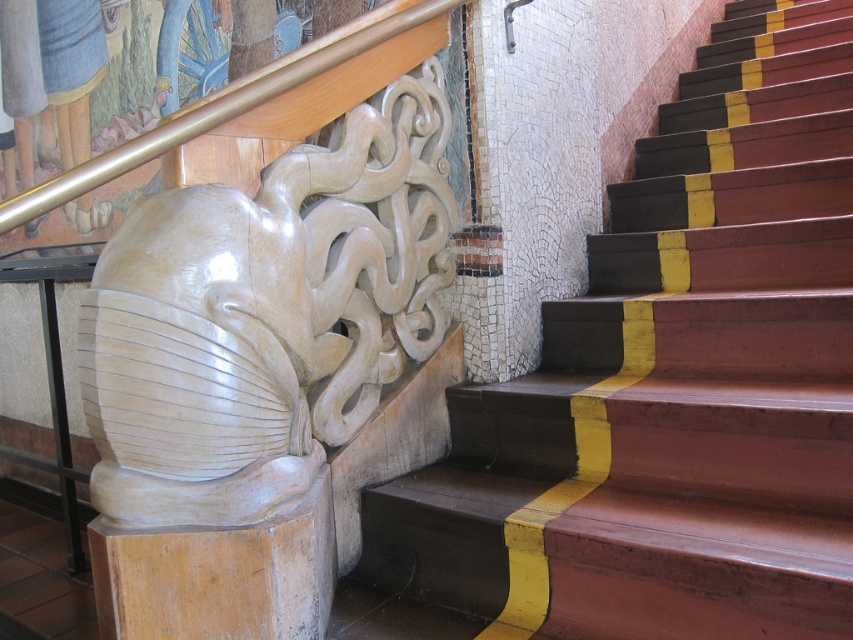
Which is below, matte white sculpture at center or gold polished metal handrail at upper left?

matte white sculpture at center

Does matte white sculpture at center have a lesser width compared to gold polished metal handrail at upper left?

Yes.

Who is more forward, (421, 227) or (102, 164)?

Point (102, 164)

Locate an element on the screen. This screenshot has width=853, height=640. matte white sculpture at center is located at coordinates (265, 316).

Can you confirm if wooden stairs at center is positioned above gold polished metal handrail at upper left?

No, wooden stairs at center is not above gold polished metal handrail at upper left.

Does point (498, 445) come farther from viewer compared to point (286, 65)?

Yes.

Who is more forward, [756,355] or [346,52]?

Positioned in front is point [346,52].

Image resolution: width=853 pixels, height=640 pixels. Find the location of `wooden stairs at center`. wooden stairs at center is located at coordinates (665, 390).

Which is behind, point (807, 580) or point (163, 368)?

The point (163, 368) is behind.

Who is more distant from viewer, (773, 545) or (215, 497)?

Point (215, 497)

Locate an element on the screen. This screenshot has height=640, width=853. wooden stairs at center is located at coordinates (665, 390).